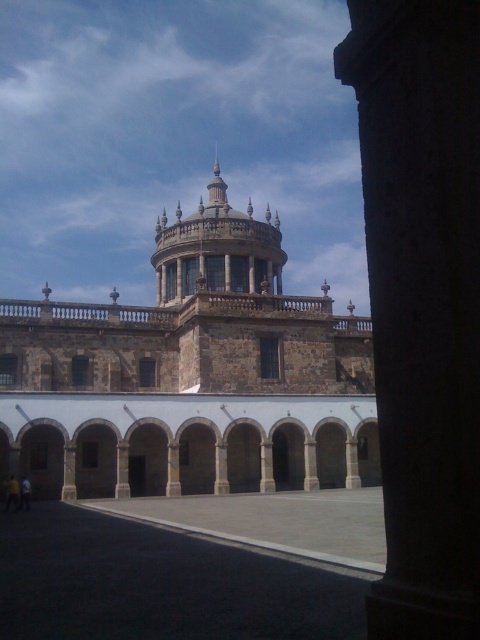
In the scene shown: Does stone dome at center appear on the right side of brown stone tower at center?

Indeed, stone dome at center is positioned on the right side of brown stone tower at center.

Is stone dome at center positioned behind brown stone tower at center?

No, it is in front of brown stone tower at center.

Where is `stone dome at center`? stone dome at center is located at coordinates (190, 376).